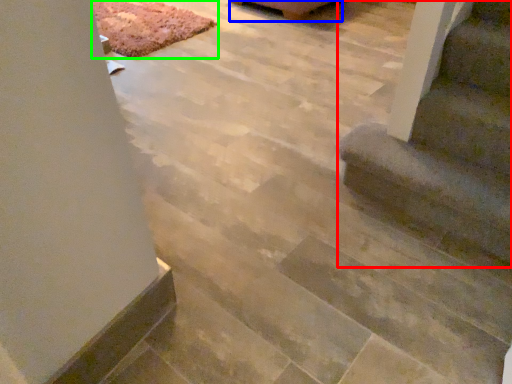
Question: Which is nearer to the stairs (highlighted by a red box)? furniture (highlighted by a blue box) or mat (highlighted by a green box).

Choices:
 (A) furniture
 (B) mat

Answer: (B)